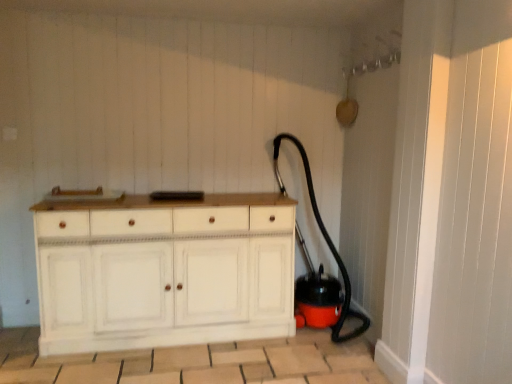
Question: Considering the relative positions of white wood chest of drawers at center and black rubber garden hose at lower right in the image provided, is white wood chest of drawers at center to the left of black rubber garden hose at lower right from the viewer's perspective?

Choices:
 (A) yes
 (B) no

Answer: (A)

Question: Can you confirm if white wood chest of drawers at center is shorter than black rubber garden hose at lower right?

Choices:
 (A) no
 (B) yes

Answer: (B)

Question: Is black rubber garden hose at lower right located within white wood chest of drawers at center?

Choices:
 (A) yes
 (B) no

Answer: (B)

Question: From the image's perspective, does white wood chest of drawers at center appear lower than black rubber garden hose at lower right?

Choices:
 (A) no
 (B) yes

Answer: (B)

Question: Considering the relative sizes of white wood chest of drawers at center and black rubber garden hose at lower right in the image provided, is white wood chest of drawers at center bigger than black rubber garden hose at lower right?

Choices:
 (A) yes
 (B) no

Answer: (A)

Question: Is white wood chest of drawers at center closer to the viewer compared to black rubber garden hose at lower right?

Choices:
 (A) yes
 (B) no

Answer: (A)

Question: Could you tell me if black rubber garden hose at lower right is turned towards white wood chest of drawers at center?

Choices:
 (A) yes
 (B) no

Answer: (B)

Question: Is black rubber garden hose at lower right at the left side of white wood chest of drawers at center?

Choices:
 (A) no
 (B) yes

Answer: (A)

Question: Is white wood chest of drawers at center at the back of black rubber garden hose at lower right?

Choices:
 (A) yes
 (B) no

Answer: (B)

Question: Is white wood chest of drawers at center a part of black rubber garden hose at lower right?

Choices:
 (A) no
 (B) yes

Answer: (A)

Question: From a real-world perspective, is black rubber garden hose at lower right positioned under white wood chest of drawers at center based on gravity?

Choices:
 (A) no
 (B) yes

Answer: (A)

Question: Is black rubber garden hose at lower right smaller than white wood chest of drawers at center?

Choices:
 (A) yes
 (B) no

Answer: (A)

Question: In terms of size, does white wood chest of drawers at center appear bigger or smaller than black rubber garden hose at lower right?

Choices:
 (A) small
 (B) big

Answer: (B)